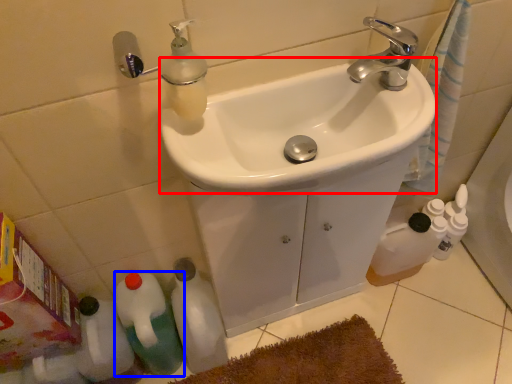
Question: Which object is further to the camera taking this photo, sink (highlighted by a red box) or bottle (highlighted by a blue box)?

Choices:
 (A) sink
 (B) bottle

Answer: (B)